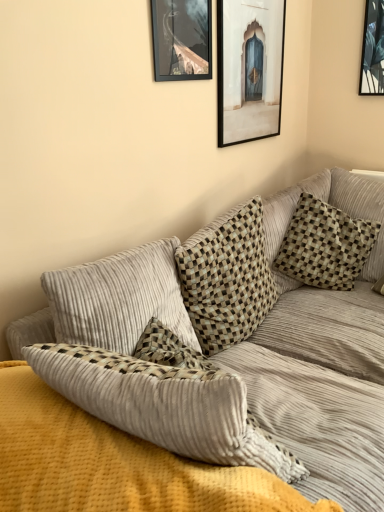
The width and height of the screenshot is (384, 512). What do you see at coordinates (182, 39) in the screenshot? I see `matte black picture frame at upper center, positioned as the first picture frame in left-to-right order` at bounding box center [182, 39].

The width and height of the screenshot is (384, 512). What do you see at coordinates (227, 278) in the screenshot? I see `checkered fabric pillow at center, which is the 2th pillow from right to left` at bounding box center [227, 278].

The height and width of the screenshot is (512, 384). What are the coordinates of `corduroy couch at center` in the screenshot? It's located at (224, 371).

Is point (187, 54) behind point (370, 237)?

No, (187, 54) is closer to viewer.

Is matte black picture frame at upper center, which is counted as the 1th picture frame, starting from the front, far from checkered fabric pillow at upper right, the 1th pillow in the right-to-left sequence?

No.

Is matte black picture frame at upper center, positioned as the second picture frame in back-to-front order, aimed at checkered fabric pillow at upper right, the 1th pillow in the right-to-left sequence?

No.

Considering the relative sizes of matte black picture frame at upper center, positioned as the second picture frame in back-to-front order, and checkered fabric pillow at upper right, the 2th pillow positioned from the left, in the image provided, is matte black picture frame at upper center, positioned as the second picture frame in back-to-front order, smaller than checkered fabric pillow at upper right, the 2th pillow positioned from the left,?

Correct, matte black picture frame at upper center, positioned as the second picture frame in back-to-front order, occupies less space than checkered fabric pillow at upper right, the 2th pillow positioned from the left.

How distant is corduroy couch at center from checkered fabric pillow at upper right, the 2th pillow positioned from the left?

A distance of 12.70 inches exists between corduroy couch at center and checkered fabric pillow at upper right, the 2th pillow positioned from the left.

Can we say corduroy couch at center lies outside checkered fabric pillow at upper right, the 1th pillow in the right-to-left sequence?

Indeed, corduroy couch at center is completely outside checkered fabric pillow at upper right, the 1th pillow in the right-to-left sequence.

From a real-world perspective, which object rests below the other?

checkered fabric pillow at upper right, the 2th pillow positioned from the left, from a real-world perspective.

Between corduroy couch at center and checkered fabric pillow at upper right, the 1th pillow in the right-to-left sequence, which one appears on the right side from the viewer's perspective?

checkered fabric pillow at upper right, the 1th pillow in the right-to-left sequence, is more to the right.

Measure the distance between checkered fabric pillow at upper right, the 1th pillow in the right-to-left sequence, and corduroy couch at center.

checkered fabric pillow at upper right, the 1th pillow in the right-to-left sequence, is 32.26 centimeters from corduroy couch at center.

From the image's perspective, is checkered fabric pillow at upper right, the 1th pillow in the right-to-left sequence, below corduroy couch at center?

No, from the image's perspective, checkered fabric pillow at upper right, the 1th pillow in the right-to-left sequence, is not below corduroy couch at center.

Is checkered fabric pillow at upper right, the 2th pillow positioned from the left, bigger or smaller than corduroy couch at center?

checkered fabric pillow at upper right, the 2th pillow positioned from the left, is smaller than corduroy couch at center.

Is matte black picture frame at upper center, positioned as the first picture frame in left-to-right order, far away from corduroy couch at center?

They are positioned close to each other.

Looking at this image, how many degrees apart are the facing directions of matte black picture frame at upper center, which is the second picture frame in right-to-left order, and corduroy couch at center?

12.7 degrees.

Can you confirm if matte black picture frame at upper center, which is the second picture frame in right-to-left order, is positioned to the right of corduroy couch at center?

Indeed, matte black picture frame at upper center, which is the second picture frame in right-to-left order, is positioned on the right side of corduroy couch at center.

How far apart are matte black picture frame at upper center, which is counted as the 1th picture frame, starting from the front, and corduroy couch at center?

matte black picture frame at upper center, which is counted as the 1th picture frame, starting from the front, is 88.94 centimeters from corduroy couch at center.

Is matte wooden picture frame at upper center, which is counted as the 1th picture frame, starting from the back, surrounding matte black picture frame at upper center, which is the second picture frame in right-to-left order?

No, matte black picture frame at upper center, which is the second picture frame in right-to-left order, is not a part of matte wooden picture frame at upper center, which is counted as the 1th picture frame, starting from the back.

Can you confirm if matte wooden picture frame at upper center, placed as the second picture frame when sorted from front to back, is smaller than matte black picture frame at upper center, positioned as the first picture frame in left-to-right order?

Incorrect, matte wooden picture frame at upper center, placed as the second picture frame when sorted from front to back, is not smaller in size than matte black picture frame at upper center, positioned as the first picture frame in left-to-right order.

Is matte wooden picture frame at upper center, marked as the 1th picture frame in a right-to-left arrangement, positioned behind matte black picture frame at upper center, which is the second picture frame in right-to-left order?

Yes.

Considering the relative positions of matte wooden picture frame at upper center, which ranks as the second picture frame in left-to-right order, and matte black picture frame at upper center, which is the second picture frame in right-to-left order, in the image provided, is matte wooden picture frame at upper center, which ranks as the second picture frame in left-to-right order, to the right of matte black picture frame at upper center, which is the second picture frame in right-to-left order, from the viewer's perspective?

Indeed, matte wooden picture frame at upper center, which ranks as the second picture frame in left-to-right order, is positioned on the right side of matte black picture frame at upper center, which is the second picture frame in right-to-left order.

Considering the positions of point (156, 49) and point (219, 16), is point (156, 49) closer or farther from the camera than point (219, 16)?

Point (156, 49) is closer to the camera than point (219, 16).

Is matte black picture frame at upper center, which is the second picture frame in right-to-left order, bigger than matte wooden picture frame at upper center, placed as the second picture frame when sorted from front to back?

No, matte black picture frame at upper center, which is the second picture frame in right-to-left order, is not bigger than matte wooden picture frame at upper center, placed as the second picture frame when sorted from front to back.

The height and width of the screenshot is (512, 384). Identify the location of picture frame above the matte wooden picture frame at upper center, placed as the second picture frame when sorted from front to back (from a real-world perspective). (182, 39).

In the image, is matte wooden picture frame at upper center, placed as the second picture frame when sorted from front to back, positioned in front of or behind checkered fabric pillow at center, the first pillow viewed from the left?

Clearly, matte wooden picture frame at upper center, placed as the second picture frame when sorted from front to back, is behind checkered fabric pillow at center, the first pillow viewed from the left.

Is matte wooden picture frame at upper center, which is counted as the 1th picture frame, starting from the back, oriented away from checkered fabric pillow at center, the first pillow viewed from the left?

No, matte wooden picture frame at upper center, which is counted as the 1th picture frame, starting from the back, is not facing the opposite direction of checkered fabric pillow at center, the first pillow viewed from the left.

Is matte wooden picture frame at upper center, marked as the 1th picture frame in a right-to-left arrangement, to the left of checkered fabric pillow at center, the first pillow viewed from the left, from the viewer's perspective?

Incorrect, matte wooden picture frame at upper center, marked as the 1th picture frame in a right-to-left arrangement, is not on the left side of checkered fabric pillow at center, the first pillow viewed from the left.

From a real-world perspective, count 2nd picture frames upward from the checkered fabric pillow at upper right, the 2th pillow positioned from the left, and point to it. Please provide its 2D coordinates.

[(182, 39)]

Locate an element on the screen. This screenshot has height=512, width=384. studio couch on the left of checkered fabric pillow at upper right, the 2th pillow positioned from the left is located at coordinates (224, 371).

Which object lies further to the anchor point checkered fabric pillow at center, which is the 2th pillow from right to left, checkered fabric pillow at upper right, the 1th pillow in the right-to-left sequence, or matte wooden picture frame at upper center, which is counted as the 1th picture frame, starting from the back?

matte wooden picture frame at upper center, which is counted as the 1th picture frame, starting from the back, is further to checkered fabric pillow at center, which is the 2th pillow from right to left.

Considering their positions, is corduroy couch at center positioned closer to checkered fabric pillow at center, which is the 2th pillow from right to left, than matte black picture frame at upper center, positioned as the second picture frame in back-to-front order?

corduroy couch at center is positioned closer to the anchor checkered fabric pillow at center, which is the 2th pillow from right to left.

Looking at this image, based on their spatial positions, is matte black picture frame at upper center, which is counted as the 1th picture frame, starting from the front, or checkered fabric pillow at upper right, the 2th pillow positioned from the left, closer to checkered fabric pillow at center, which is the 2th pillow from right to left?

checkered fabric pillow at upper right, the 2th pillow positioned from the left, lies closer to checkered fabric pillow at center, which is the 2th pillow from right to left, than the other object.

When comparing their distances from matte black picture frame at upper center, which is counted as the 1th picture frame, starting from the front, does checkered fabric pillow at upper right, the 2th pillow positioned from the left, or matte wooden picture frame at upper center, which is counted as the 1th picture frame, starting from the back, seem closer?

matte wooden picture frame at upper center, which is counted as the 1th picture frame, starting from the back, lies closer to matte black picture frame at upper center, which is counted as the 1th picture frame, starting from the front, than the other object.

Based on the photo, from the image, which object appears to be farther from corduroy couch at center, matte black picture frame at upper center, which is counted as the 1th picture frame, starting from the front, or checkered fabric pillow at upper right, the 1th pillow in the right-to-left sequence?

Based on the image, matte black picture frame at upper center, which is counted as the 1th picture frame, starting from the front, appears to be further to corduroy couch at center.

Based on the photo, when comparing their distances from checkered fabric pillow at center, which is the 2th pillow from right to left, does matte wooden picture frame at upper center, which ranks as the second picture frame in left-to-right order, or corduroy couch at center seem closer?

corduroy couch at center.

When comparing their distances from checkered fabric pillow at upper right, the 1th pillow in the right-to-left sequence, does corduroy couch at center or matte black picture frame at upper center, positioned as the second picture frame in back-to-front order, seem further?

Based on the image, matte black picture frame at upper center, positioned as the second picture frame in back-to-front order, appears to be further to checkered fabric pillow at upper right, the 1th pillow in the right-to-left sequence.

Based on the photo, looking at the image, which one is located further to matte wooden picture frame at upper center, placed as the second picture frame when sorted from front to back, checkered fabric pillow at center, which is the 2th pillow from right to left, or checkered fabric pillow at upper right, the 2th pillow positioned from the left?

The object further to matte wooden picture frame at upper center, placed as the second picture frame when sorted from front to back, is checkered fabric pillow at upper right, the 2th pillow positioned from the left.

The height and width of the screenshot is (512, 384). I want to click on pillow between matte black picture frame at upper center, positioned as the second picture frame in back-to-front order, and checkered fabric pillow at center, which is the 2th pillow from right to left, in the up-down direction, so click(x=325, y=245).

Locate an element on the screen. This screenshot has width=384, height=512. pillow between matte wooden picture frame at upper center, which is counted as the 1th picture frame, starting from the back, and checkered fabric pillow at center, the first pillow viewed from the left, vertically is located at coordinates (325, 245).

Find the location of a particular element. The width and height of the screenshot is (384, 512). picture frame that lies between matte black picture frame at upper center, which is counted as the 1th picture frame, starting from the front, and corduroy couch at center from top to bottom is located at coordinates (249, 69).

What are the coordinates of `picture frame between matte black picture frame at upper center, which is counted as the 1th picture frame, starting from the front, and checkered fabric pillow at center, the first pillow viewed from the left, in the up-down direction` in the screenshot? It's located at (249, 69).